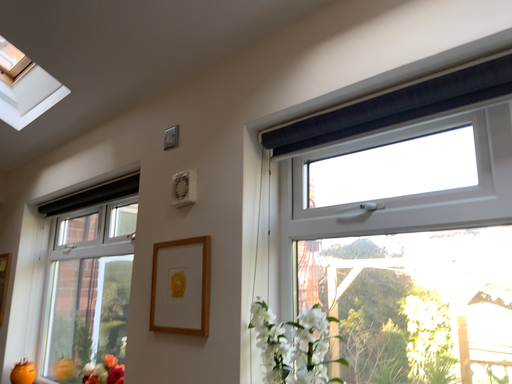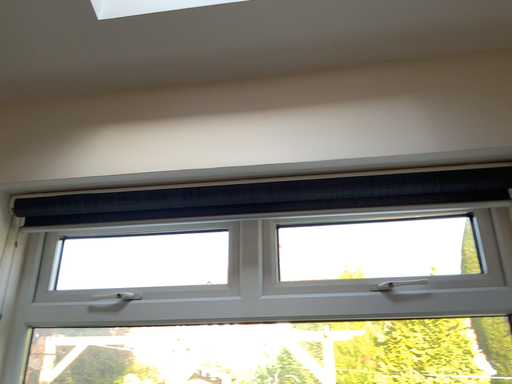
Question: Which way did the camera rotate in the video?

Choices:
 (A) rotated left
 (B) rotated right

Answer: (B)